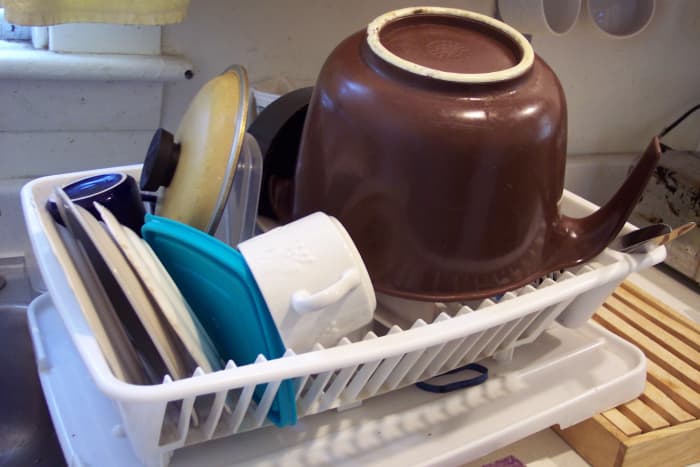
This screenshot has height=467, width=700. Identify the location of dish dryer rack. (400, 343), (661, 334).